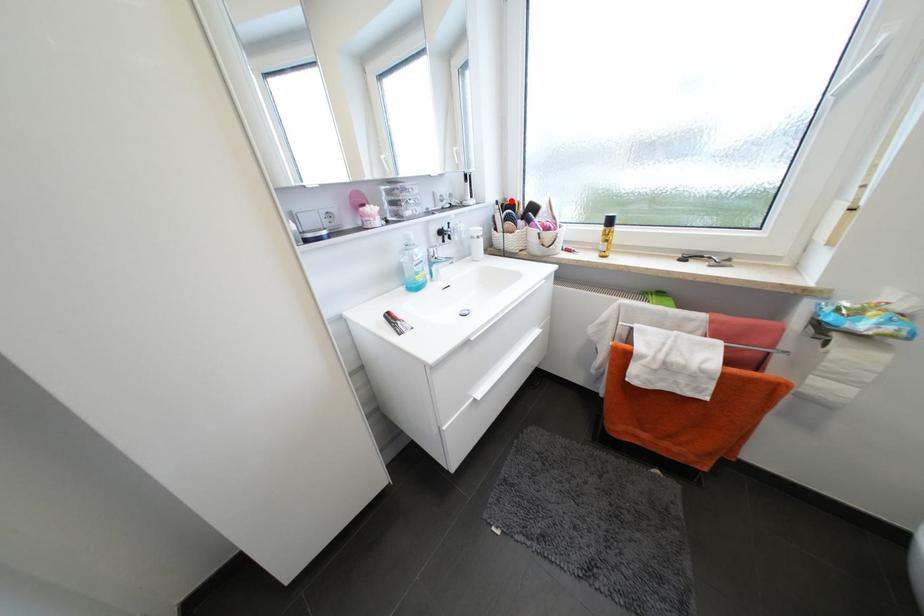
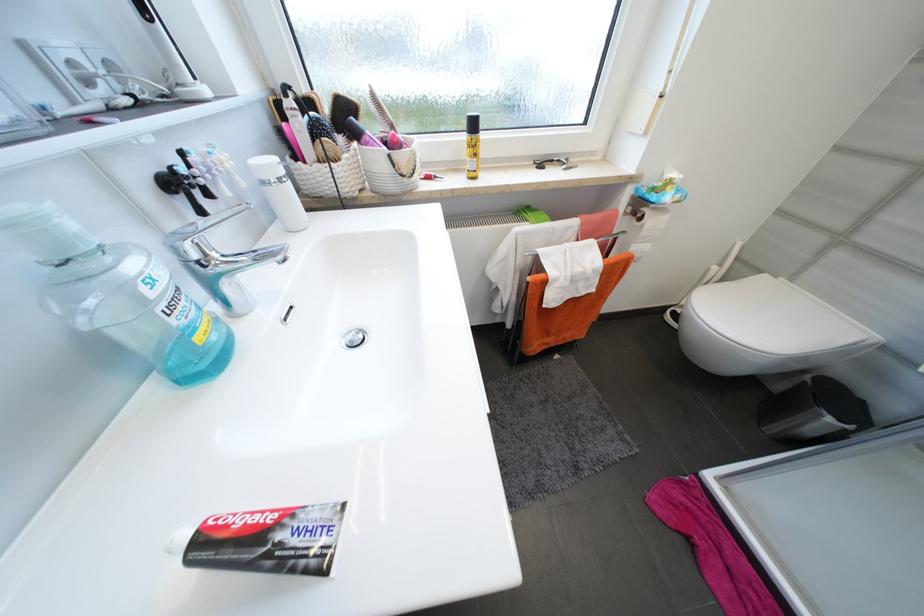
The point at the highlighted location is marked in the first image. Where is the corresponding point in the second image?

(280, 92)